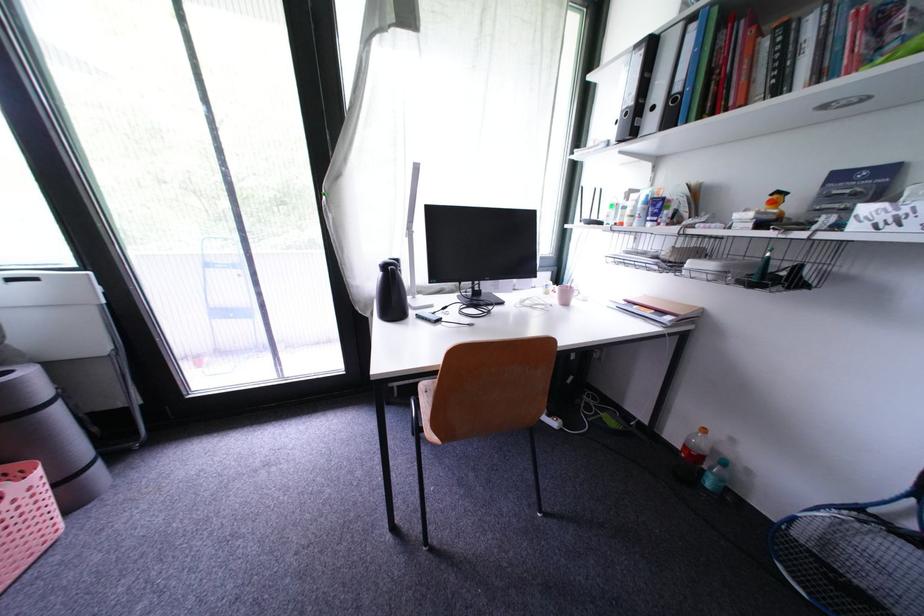
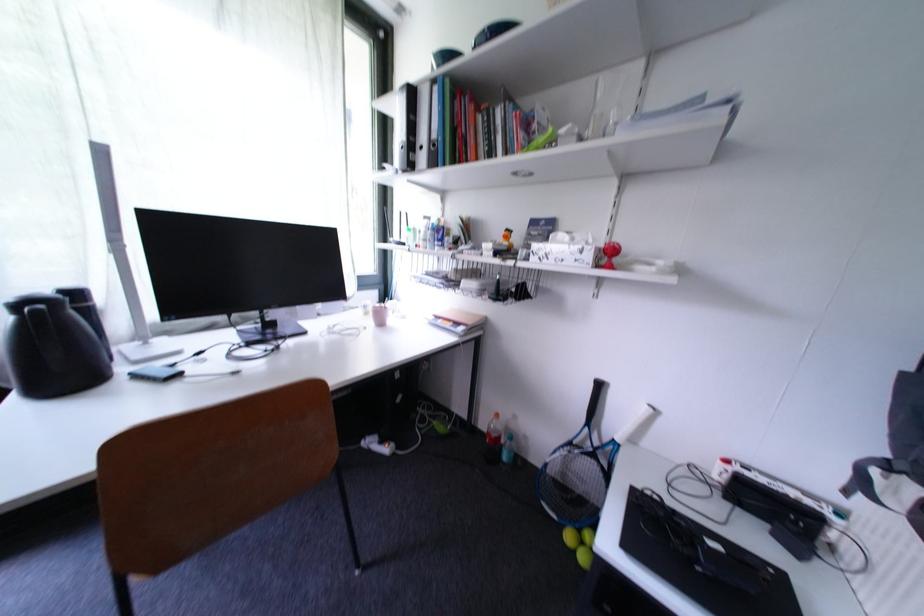
Find the pixel in the second image that matches pixel 661 111 in the first image.

(430, 150)